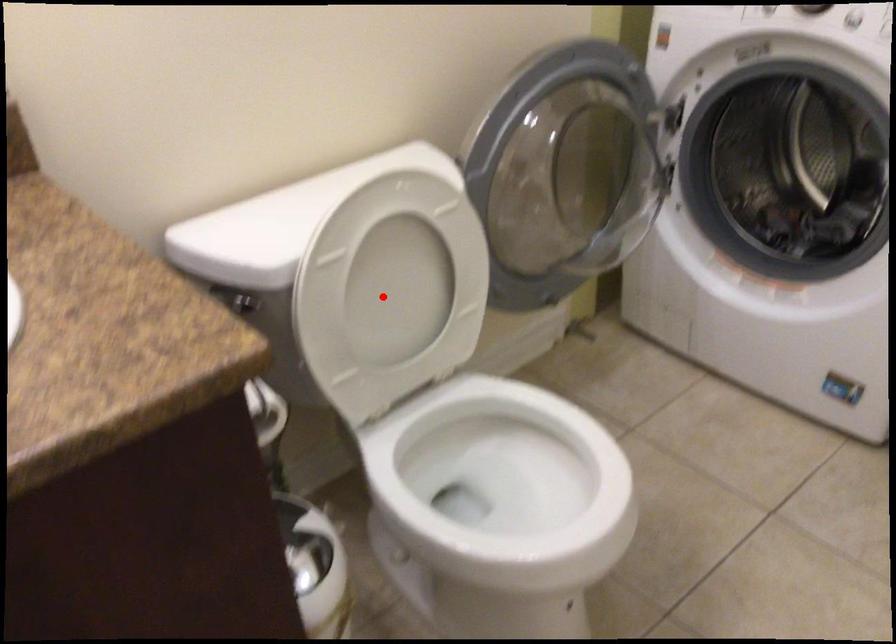
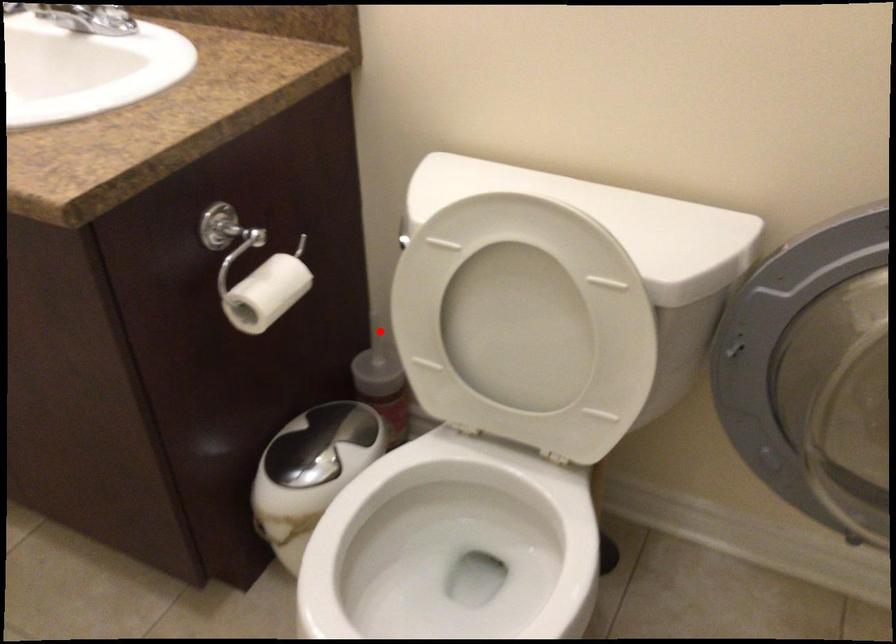
I am providing you with two images of the same scene from different viewpoints. A red point is marked on the first image and another point is marked on the second image. Is the marked point in image1 the same physical position as the marked point in image2?

No